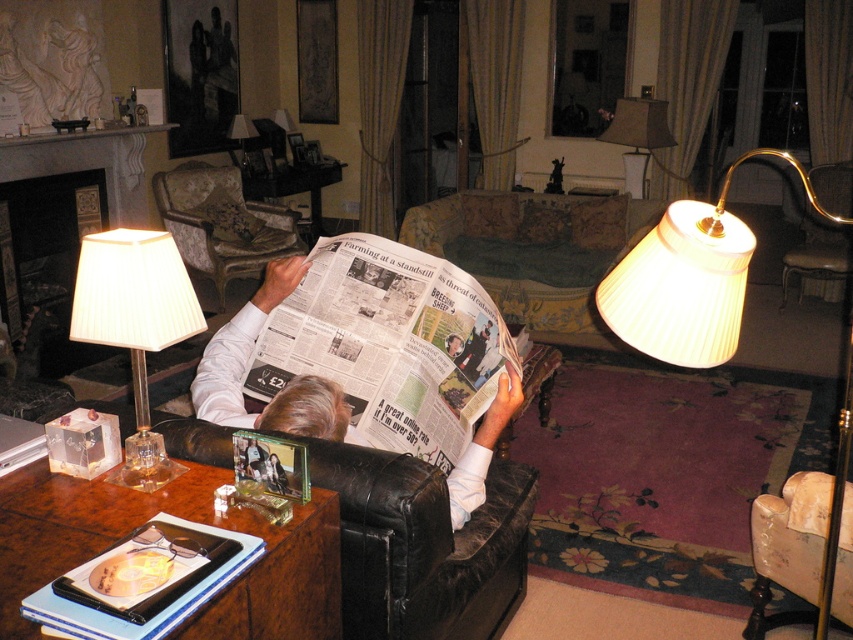
You are planning to place a new coffee table between the green fabric couch at center and the white pleated lampshade at upper center. Considering their sizes, which object should the coffee table be closer to?

The coffee table should be closer to the white pleated lampshade at upper center because the green fabric couch at center is larger in size and requires more space around it.

You are planning to place a new small side table between the green fabric couch at center and the white pleated fabric lampshade at left. Considering their widths, will the side table fit comfortably between them?

The green fabric couch at center is wider than the white pleated fabric lampshade at left, so placing a small side table between them should be feasible as there is enough space between their widths.